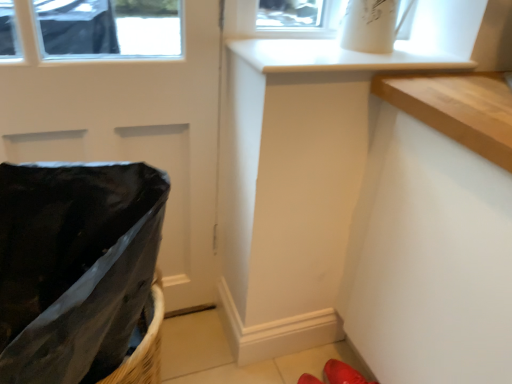
Question: Does red rubber shoes at lower right have a greater height compared to glossy black door at left?

Choices:
 (A) yes
 (B) no

Answer: (B)

Question: From the image's perspective, is red rubber shoes at lower right above glossy black door at left?

Choices:
 (A) no
 (B) yes

Answer: (A)

Question: Is red rubber shoes at lower right bigger than glossy black door at left?

Choices:
 (A) no
 (B) yes

Answer: (A)

Question: From the image's perspective, is red rubber shoes at lower right located beneath glossy black door at left?

Choices:
 (A) no
 (B) yes

Answer: (B)

Question: Is red rubber shoes at lower right smaller than glossy black door at left?

Choices:
 (A) yes
 (B) no

Answer: (A)

Question: Would you consider red rubber shoes at lower right to be distant from glossy black door at left?

Choices:
 (A) no
 (B) yes

Answer: (A)

Question: From a real-world perspective, is glossy black door at left on red rubber shoes at lower right?

Choices:
 (A) no
 (B) yes

Answer: (B)

Question: Would you say red rubber shoes at lower right is part of glossy black door at left's contents?

Choices:
 (A) yes
 (B) no

Answer: (B)

Question: Considering the relative sizes of glossy black door at left and red rubber shoes at lower right in the image provided, is glossy black door at left bigger than red rubber shoes at lower right?

Choices:
 (A) no
 (B) yes

Answer: (B)

Question: From the image's perspective, is glossy black door at left located beneath red rubber shoes at lower right?

Choices:
 (A) no
 (B) yes

Answer: (A)

Question: Does glossy black door at left have a greater width compared to red rubber shoes at lower right?

Choices:
 (A) yes
 (B) no

Answer: (B)

Question: Does glossy black door at left have a lesser height compared to red rubber shoes at lower right?

Choices:
 (A) no
 (B) yes

Answer: (A)

Question: Can you confirm if red rubber shoes at lower right is thinner than black plastic laundry basket at left?

Choices:
 (A) yes
 (B) no

Answer: (A)